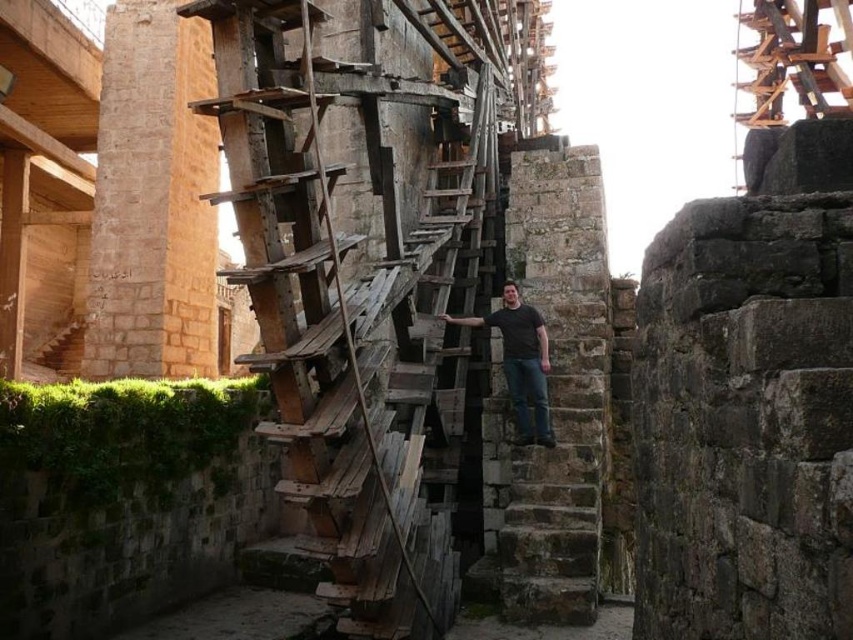
Question: Is weathered wood stairs at center further to the viewer compared to dark gray t-shirt at center?

Choices:
 (A) yes
 (B) no

Answer: (B)

Question: Which object is farther from the camera taking this photo?

Choices:
 (A) weathered wood stairs at center
 (B) dark gray t-shirt at center

Answer: (B)

Question: Is weathered wood stairs at center closer to camera compared to dark gray t-shirt at center?

Choices:
 (A) no
 (B) yes

Answer: (B)

Question: From the image, what is the correct spatial relationship of weathered wood stairs at center in relation to dark gray t-shirt at center?

Choices:
 (A) right
 (B) left

Answer: (B)

Question: Which of the following is the closest to the observer?

Choices:
 (A) (312, 240)
 (B) (512, 378)

Answer: (A)